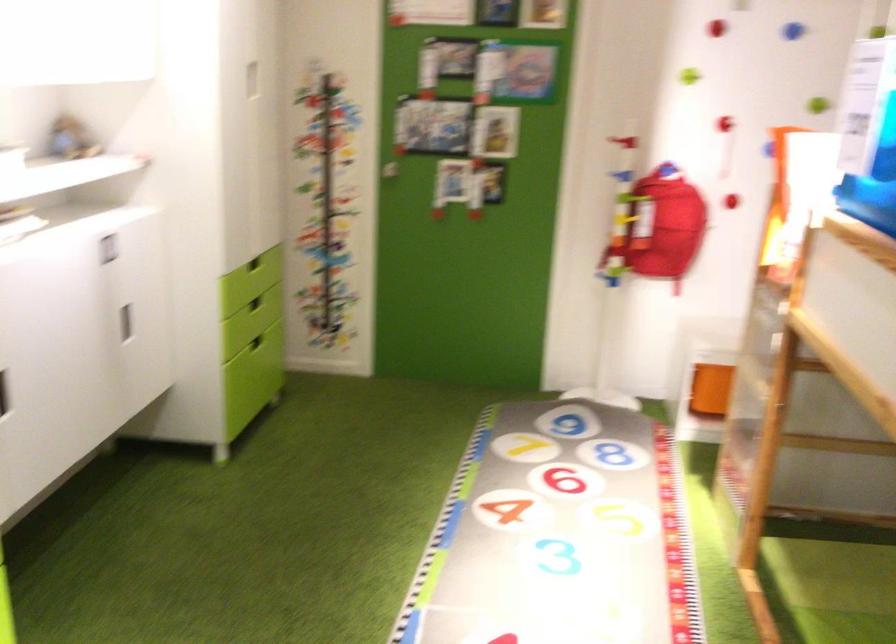
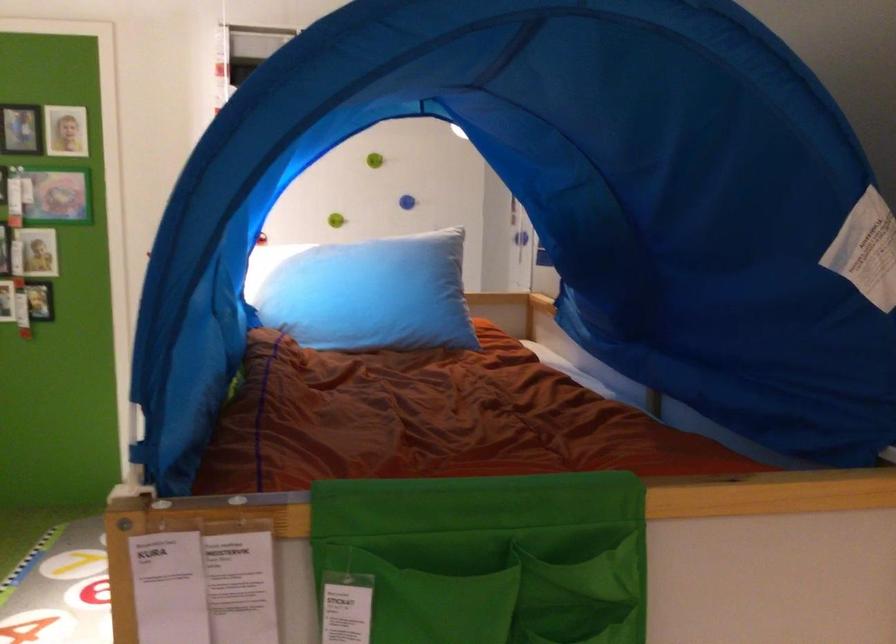
Find the pixel in the second image that matches the point at 493,116 in the first image.

(39, 251)